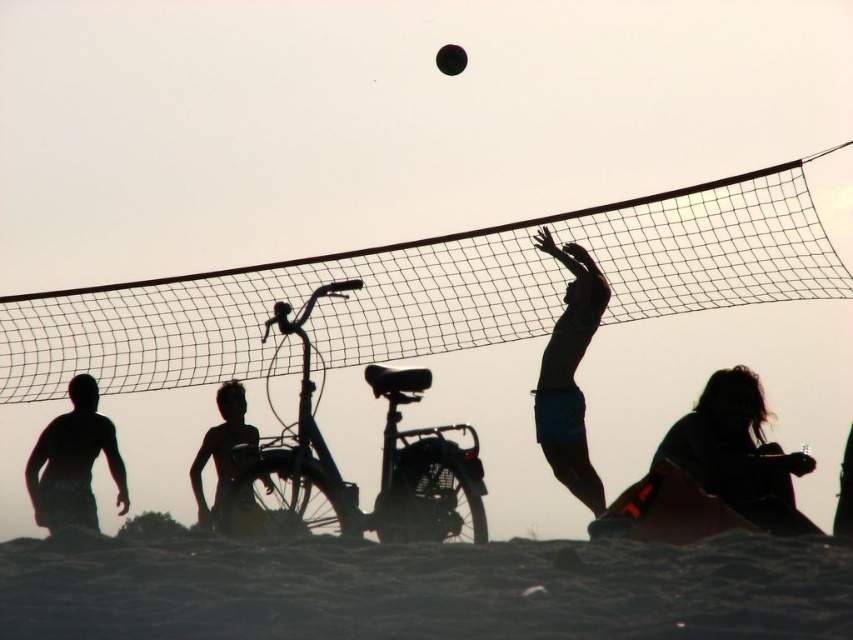
Looking at this image, you are a photographer trying to capture a photo of the volleyball game. You need to ensure that both the black mesh net at upper center and the silhouette shorts at lower left are in focus. Which object should you focus on first to ensure depth of field covers both?

The black mesh net at upper center is taller than the silhouette shorts at lower left. To ensure both are in focus, you should focus on the black mesh net at upper center first since it is farther away and taller, allowing the depth of field to cover the closer and shorter silhouette shorts at lower left.

Consider the image. You are a photographer trying to capture the action of the volleyball game. You notice two players wearing shorts in the frame. The first is wearing blue matte shorts at center, and the second has silhouette shorts at lower left. Which player should you zoom in on if you want to focus on the wider pair of shorts?

The blue matte shorts at center are wider than the silhouette shorts at lower left, so you should zoom in on the blue matte shorts at center to focus on the wider pair of shorts.

You are a photographer trying to capture the perfect shot of the volleyball game. You notice two points of interest marked as point (553, 326) and point (83, 374). Which point should you focus on to ensure it appears larger in your photo?

Point (553, 326) is closer to the camera than point (83, 374), so focusing on point (553, 326) will make it appear larger in the photo.